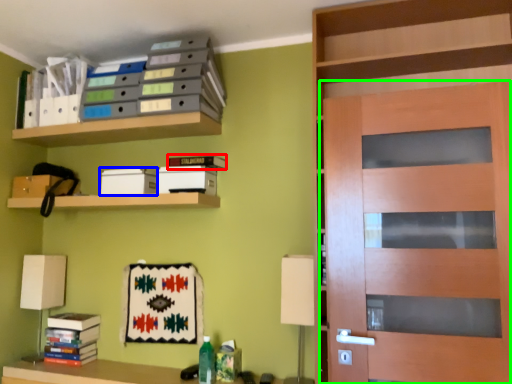
Question: Estimate the real-world distances between objects in this image. Which object is farther from book (highlighted by a red box), storage box (highlighted by a blue box) or door (highlighted by a green box)?

Choices:
 (A) storage box
 (B) door

Answer: (B)